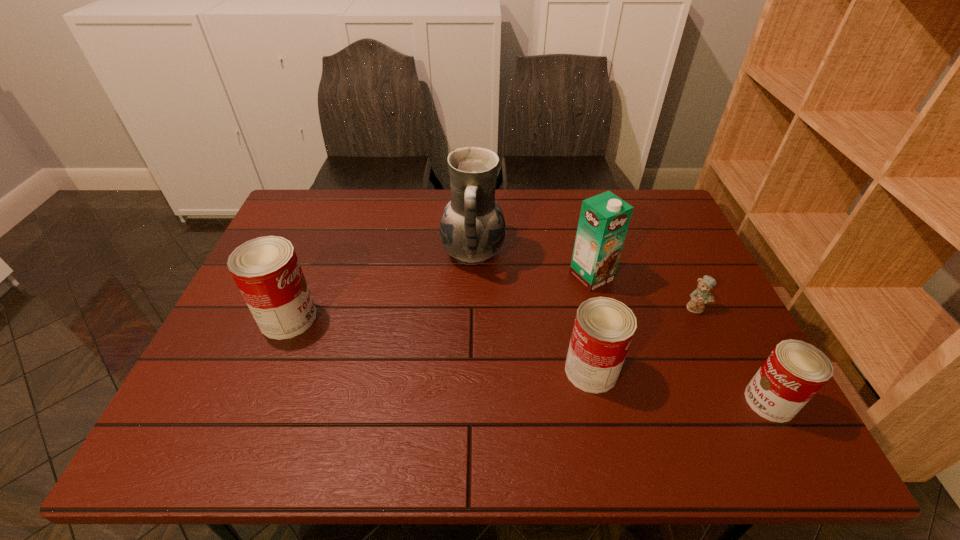
Locate an element on the screen. The height and width of the screenshot is (540, 960). the farthest can is located at coordinates (266, 270).

The width and height of the screenshot is (960, 540). Find the location of `the leftmost can`. the leftmost can is located at coordinates (266, 270).

Identify the location of the second tallest can. The height and width of the screenshot is (540, 960). (603, 330).

This screenshot has width=960, height=540. I want to click on the second can from left to right, so click(603, 330).

At what (x,y) coordinates should I click in order to perform the action: click on the fifth tallest object. Please return your answer as a coordinate pair (x, y). The width and height of the screenshot is (960, 540). Looking at the image, I should click on (795, 371).

Identify the location of the shortest can. This screenshot has height=540, width=960. (x=795, y=371).

You are a GUI agent. You are given a task and a screenshot of the screen. Output one action in this format:
    pyautogui.click(x=<x>, y=<y>)
    Task: Click on the tallest object
    
    Given the screenshot: What is the action you would take?
    pyautogui.click(x=472, y=229)

Where is `pitcher`? pitcher is located at coordinates (472, 229).

I want to click on the fifth shortest object, so click(604, 219).

You are a GUI agent. You are given a task and a screenshot of the screen. Output one action in this format:
    pyautogui.click(x=<x>, y=<y>)
    Task: Click on the shortest object
    
    Given the screenshot: What is the action you would take?
    pyautogui.click(x=702, y=295)